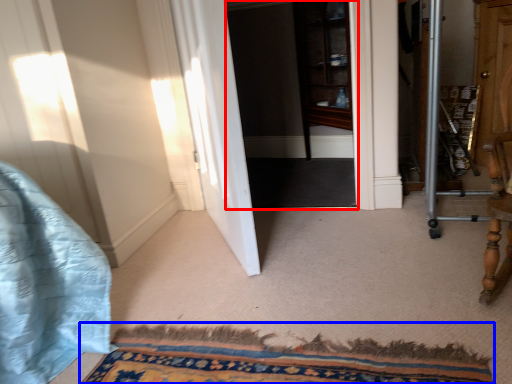
Question: Which object is closer to the camera taking this photo, screen door (highlighted by a red box) or doormat (highlighted by a blue box)?

Choices:
 (A) screen door
 (B) doormat

Answer: (B)